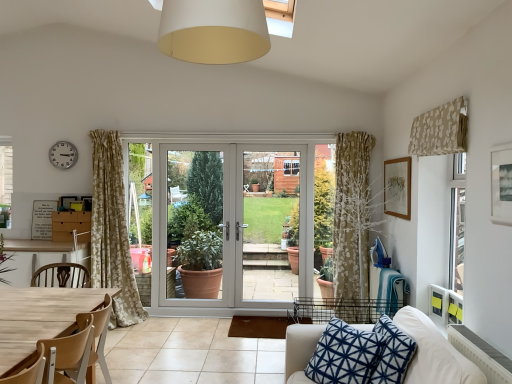
Locate an element on the screen. free space above white glossy door at center, which appears as the 1th screen door when viewed from the right (from a real-world perspective) is located at coordinates (271, 144).